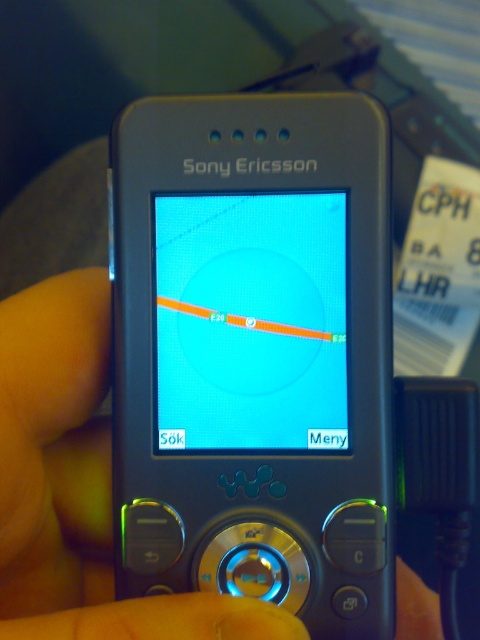
You are holding a Sony Ericsson Walkman phone and see both the metallic gray hand at center and the blue glossy screen at center. Which object is taller?

The metallic gray hand at center is taller than the blue glossy screen at center.